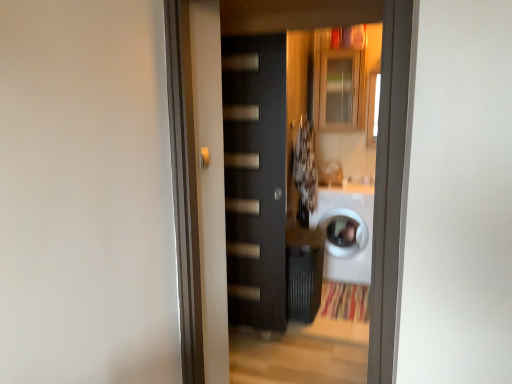
Question: Is matte glass cabinet at upper center bigger than matte black door handle at center?

Choices:
 (A) no
 (B) yes

Answer: (B)

Question: Is matte glass cabinet at upper center wider than matte black door handle at center?

Choices:
 (A) yes
 (B) no

Answer: (A)

Question: Considering the relative positions of matte glass cabinet at upper center and matte black door handle at center in the image provided, is matte glass cabinet at upper center in front of matte black door handle at center?

Choices:
 (A) no
 (B) yes

Answer: (A)

Question: Is matte glass cabinet at upper center thinner than matte black door handle at center?

Choices:
 (A) no
 (B) yes

Answer: (A)

Question: Does matte glass cabinet at upper center lie behind matte black door handle at center?

Choices:
 (A) yes
 (B) no

Answer: (A)

Question: Is matte glass cabinet at upper center touching matte black door handle at center?

Choices:
 (A) no
 (B) yes

Answer: (A)

Question: From a real-world perspective, is matte glass cabinet at upper center positioned over fluffy white laundry at center based on gravity?

Choices:
 (A) no
 (B) yes

Answer: (B)

Question: Is matte glass cabinet at upper center oriented towards fluffy white laundry at center?

Choices:
 (A) yes
 (B) no

Answer: (B)

Question: Considering the relative sizes of matte glass cabinet at upper center and fluffy white laundry at center in the image provided, is matte glass cabinet at upper center smaller than fluffy white laundry at center?

Choices:
 (A) yes
 (B) no

Answer: (B)

Question: Is the depth of matte glass cabinet at upper center greater than that of fluffy white laundry at center?

Choices:
 (A) yes
 (B) no

Answer: (A)

Question: Is the depth of matte glass cabinet at upper center less than that of fluffy white laundry at center?

Choices:
 (A) yes
 (B) no

Answer: (B)

Question: Considering the relative sizes of matte glass cabinet at upper center and fluffy white laundry at center in the image provided, is matte glass cabinet at upper center wider than fluffy white laundry at center?

Choices:
 (A) no
 (B) yes

Answer: (B)

Question: From a real-world perspective, is matte black door handle at center physically below white glossy washing machine at center?

Choices:
 (A) yes
 (B) no

Answer: (B)